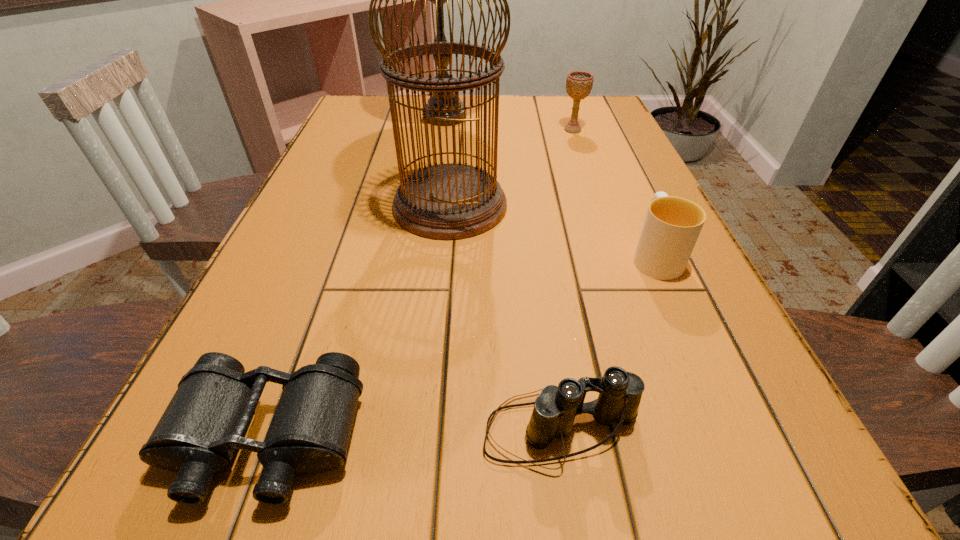
Identify the location of free spot between the chalice and the lamp. The height and width of the screenshot is (540, 960). (509, 124).

This screenshot has height=540, width=960. In order to click on free point between the birdcage and the chalice in this screenshot , I will do `click(512, 167)`.

The image size is (960, 540). In order to click on free spot between the third shortest object and the right binoculars in this screenshot , I will do `click(608, 342)`.

The height and width of the screenshot is (540, 960). In order to click on vacant region between the shortest object and the right binoculars in this screenshot , I will do `click(414, 434)`.

Locate an element on the screen. vacant space that is in between the birdcage and the shortest object is located at coordinates (358, 322).

At what (x,y) coordinates should I click in order to perform the action: click on unoccupied area between the lamp and the chalice. Please return your answer as a coordinate pair (x, y). This screenshot has width=960, height=540. Looking at the image, I should click on (509, 124).

You are a GUI agent. You are given a task and a screenshot of the screen. Output one action in this format:
    pyautogui.click(x=<x>, y=<y>)
    Task: Click on the free space between the taller binoculars and the fourth tallest object
    This screenshot has height=540, width=960.
    Given the screenshot: What is the action you would take?
    pyautogui.click(x=608, y=342)

Locate which object ranks in proximity to the shorter binoculars. Please provide its 2D coordinates. Your answer should be formatted as a tuple, i.e. [(x, y)], where the tuple contains the x and y coordinates of a point satisfying the conditions above.

[(620, 392)]

Locate which object is the fifth closest to the birdcage. Please provide its 2D coordinates. Your answer should be formatted as a tuple, i.e. [(x, y)], where the tuple contains the x and y coordinates of a point satisfying the conditions above.

[(620, 392)]

The image size is (960, 540). Find the location of `free space that satisfies the following two spatial constraints: 1. on the back side of the right binoculars; 2. on the right side of the third tallest object`. free space that satisfies the following two spatial constraints: 1. on the back side of the right binoculars; 2. on the right side of the third tallest object is located at coordinates (518, 130).